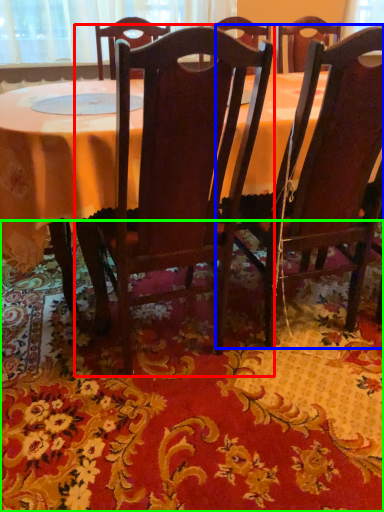
Question: Which object is the farthest from chair (highlighted by a red box)? Choose among these: chair (highlighted by a blue box) or mat (highlighted by a green box).

Choices:
 (A) chair
 (B) mat

Answer: (B)